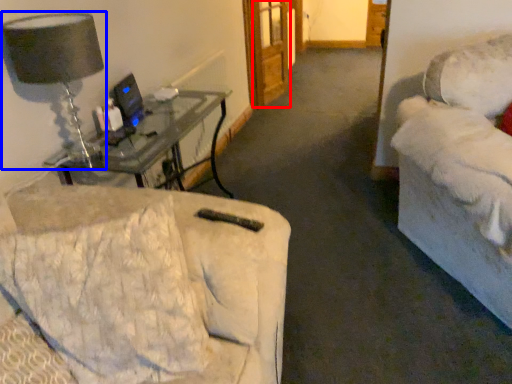
Question: Which point is closer to the camera, glass door (highlighted by a red box) or table lamp (highlighted by a blue box)?

Choices:
 (A) glass door
 (B) table lamp

Answer: (B)